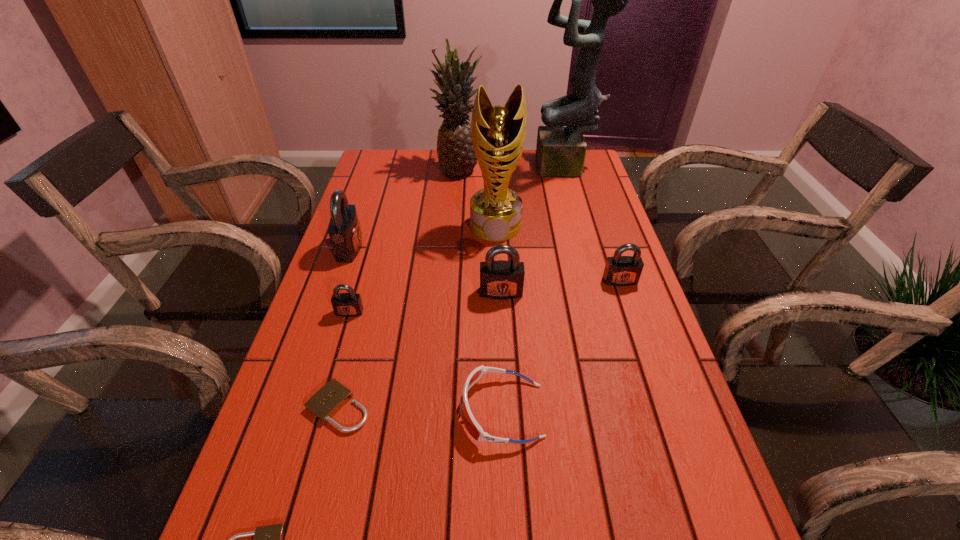
Find the location of `vacant space located 0.350m on the front-facing side of the gold award`. vacant space located 0.350m on the front-facing side of the gold award is located at coordinates (500, 339).

I want to click on vacant space positioned on the front of the farthest gray padlock near the keyhole, so click(x=484, y=248).

I want to click on free space located 0.240m on the front of the third gray padlock from left to right near the keyhole, so coord(506,384).

Identify the location of vacant region located 0.090m on the front of the rightmost padlock near the keyhole. The height and width of the screenshot is (540, 960). (631, 313).

In order to click on vacant space located 0.320m on the front of the third nearest padlock near the keyhole in this screenshot , I will do `click(310, 448)`.

This screenshot has width=960, height=540. I want to click on free space located on the front-facing side of the third shortest object, so click(302, 410).

This screenshot has height=540, width=960. I want to click on vacant space located 0.310m on the front-facing side of the third shortest object, so click(x=302, y=410).

At what (x,y) coordinates should I click in order to perform the action: click on free location located 0.110m on the front-facing side of the third shortest object. Please return your answer as a coordinate pair (x, y). The height and width of the screenshot is (540, 960). Looking at the image, I should click on (404, 410).

Locate an element on the screen. free space located on the back of the bigger beige padlock is located at coordinates (363, 311).

Identify the location of sculpture positioned at the far edge. (561, 148).